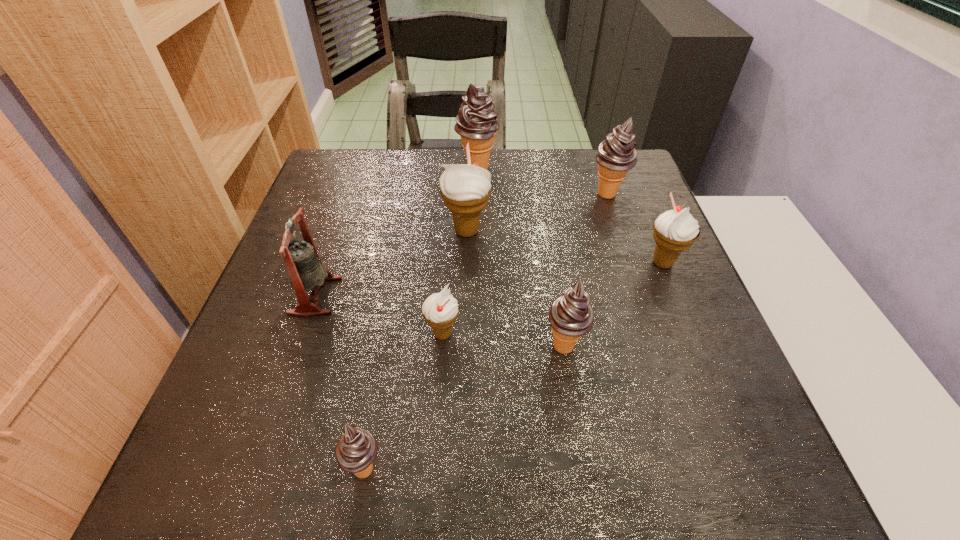
At what (x,y) coordinates should I click in order to perform the action: click on free space that is in between the leftmost object and the nearest white icecream. Please return your answer as a coordinate pair (x, y). This screenshot has height=540, width=960. Looking at the image, I should click on pos(379,315).

Where is `free space between the farthest chocolate icecream and the second chocolate icecream from right to left`? free space between the farthest chocolate icecream and the second chocolate icecream from right to left is located at coordinates (520, 257).

The width and height of the screenshot is (960, 540). What are the coordinates of `free area in between the third farthest object and the second chocolate icecream from right to left` in the screenshot? It's located at (516, 288).

Locate an element on the screen. unoccupied position between the second object from left to right and the fourth farthest icecream is located at coordinates (514, 366).

The image size is (960, 540). Identify the location of free space between the rightmost chocolate icecream and the nearest object. (486, 332).

The image size is (960, 540). I want to click on free spot between the nearest white icecream and the tallest icecream, so pos(460,252).

Locate an element on the screen. The image size is (960, 540). vacant point located between the second farthest white icecream and the leftmost icecream is located at coordinates (514, 366).

At what (x,y) coordinates should I click in order to perform the action: click on free space between the nearest chocolate icecream and the smallest white icecream. Please return your answer as a coordinate pair (x, y). This screenshot has height=540, width=960. Looking at the image, I should click on (404, 401).

What are the coordinates of `free space between the second chocolate icecream from right to left and the sixth nearest icecream` in the screenshot? It's located at (586, 270).

Identify the location of the seventh closest object to the second nearest chocolate icecream. This screenshot has height=540, width=960. (476, 122).